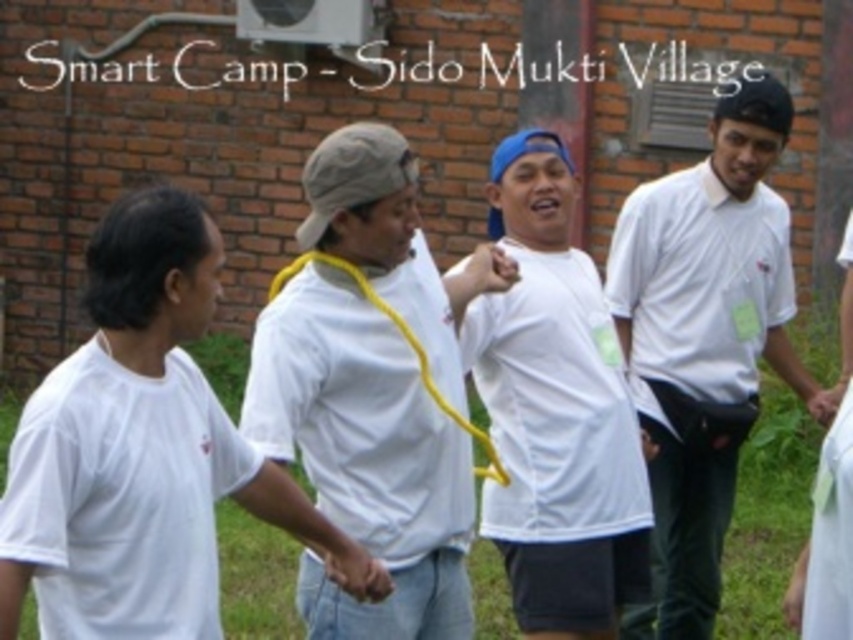
You are a photographer standing at the center of the scene. You want to capture a photo that includes both the white matte shirt at left and the white matte shirt at center. Given that your camera has a maximum focus range of 5 feet, will you be able to capture both subjects clearly in the same frame?

The distance between the white matte shirt at left and the white matte shirt at center is 4.73 feet, which is within the camera maximum focus range of 5 feet. Therefore, both subjects can be captured clearly in the same frame.